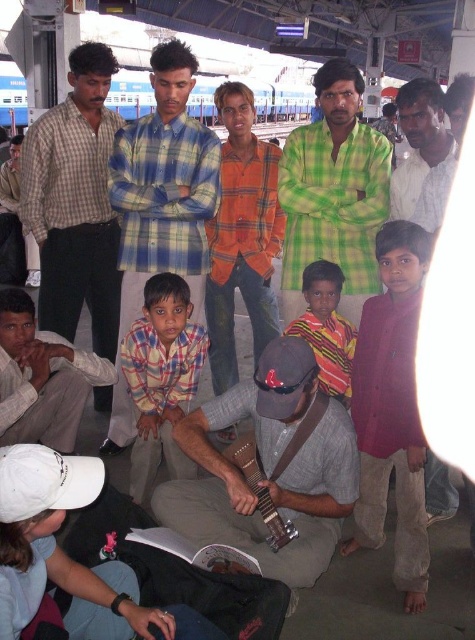
Question: Can you confirm if blue plaid shirt at center is wider than red cotton shirt at center?

Choices:
 (A) yes
 (B) no

Answer: (A)

Question: Is light brown cotton pants at lower left below red shirt at right?

Choices:
 (A) yes
 (B) no

Answer: (A)

Question: Among these objects, which one is nearest to the camera?

Choices:
 (A) striped shirt at center
 (B) checkered shirt at left

Answer: (A)

Question: Which of the following is the closest to the observer?

Choices:
 (A) checkered shirt at left
 (B) checkered fabric shirt at center
 (C) wooden acoustic guitar at center

Answer: (C)

Question: Estimate the real-world distances between objects in this image. Which object is farther from the wooden acoustic guitar at center?

Choices:
 (A) striped shirt at center
 (B) green plaid shirt at center
 (C) checkered fabric shirt at center

Answer: (B)

Question: Does light brown cotton pants at lower left appear under red shirt at right?

Choices:
 (A) no
 (B) yes

Answer: (B)